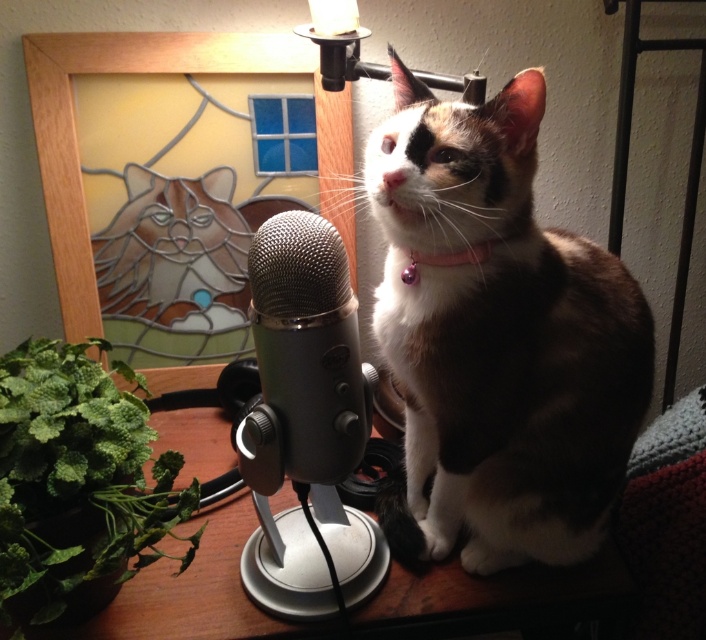
You are setting up a live stream and need to place a small camera between the green leafy plant at lower left and the satin silver microphone at center. The camera requires a minimum of 8 inches of space to avoid interference. Based on the current setup, will there be enough space for the camera?

The green leafy plant at lower left and the satin silver microphone at center are 7.44 inches apart. Since the camera requires a minimum of 8 inches of space, there is not enough space between them to place the camera without interference.

From the picture: You are setting up a new camera to film the satin silver microphone at center and the green leafy plant at lower left. To ensure both are in frame, should you position the camera to the right or left of the setup?

The green leafy plant at lower left is to the left of the satin silver microphone at center, so positioning the camera to the right of the setup would allow both objects to be in frame.

Based on the scene description, what are the coordinates of the calico fur cat at center?

The calico fur cat at center is located at coordinates point (x=498, y=339).